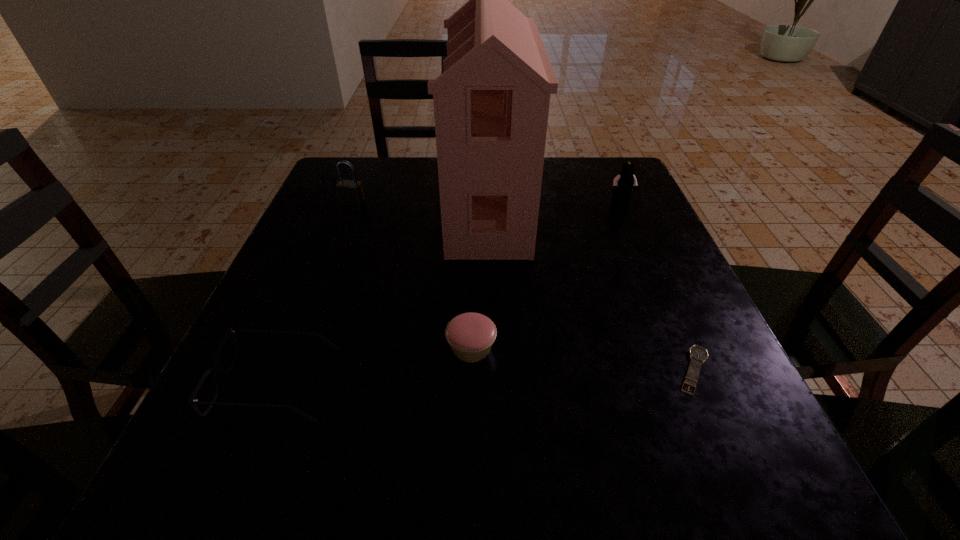
The height and width of the screenshot is (540, 960). Find the location of `free space located on the front-facing side of the Lego`. free space located on the front-facing side of the Lego is located at coordinates (639, 245).

Image resolution: width=960 pixels, height=540 pixels. What are the coordinates of `free space located 0.270m with the lenses facing outward on the spectacles` in the screenshot? It's located at (507, 384).

This screenshot has height=540, width=960. I want to click on free location located 0.250m on the back of the cupcake, so click(473, 240).

This screenshot has width=960, height=540. I want to click on free space located 0.050m on the left of the shortest object, so click(x=640, y=370).

Locate an element on the screen. The image size is (960, 540). dollhouse that is positioned at the far edge is located at coordinates point(491,103).

Identify the location of padlock at the far edge. (350, 192).

Find the location of `Lego located at the far edge`. Lego located at the far edge is located at coordinates (623, 183).

Where is `padlock that is positioned at the left edge`? The height and width of the screenshot is (540, 960). padlock that is positioned at the left edge is located at coordinates (350, 192).

In order to click on spectacles located at the left edge in this screenshot , I will do `click(215, 368)`.

Locate an element on the screen. Image resolution: width=960 pixels, height=540 pixels. Lego at the right edge is located at coordinates (623, 183).